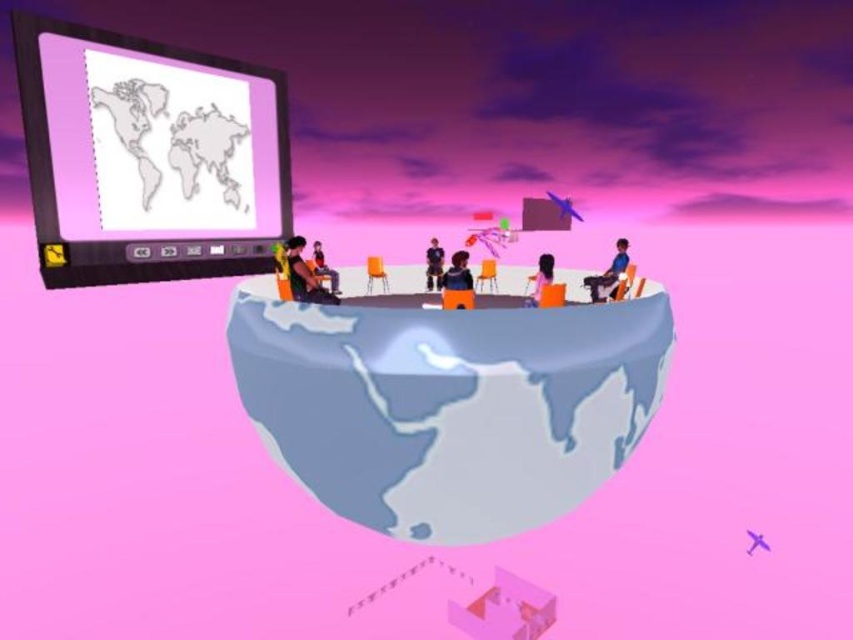
Question: Which point is closer to the camera?

Choices:
 (A) matte black jacket at center
 (B) orange fabric chair at center
 (C) matte black chair at lower left

Answer: (C)

Question: Among these points, which one is farthest from the camera?

Choices:
 (A) (321, 388)
 (B) (445, 275)

Answer: (B)

Question: Is matte plastic projector screen at upper left closer to camera compared to orange fabric chair at center?

Choices:
 (A) no
 (B) yes

Answer: (B)

Question: Which object appears closest to the camera in this image?

Choices:
 (A) matte black jacket at center
 (B) matte orange chair at center
 (C) matte black chair at lower left
 (D) matte plastic projector screen at upper left

Answer: (D)

Question: Is matte plastic projector screen at upper left above matte black jacket at center?

Choices:
 (A) no
 (B) yes

Answer: (B)

Question: Observing the image, what is the correct spatial positioning of smooth gray globe at center in reference to matte orange chair at center?

Choices:
 (A) above
 (B) below

Answer: (B)